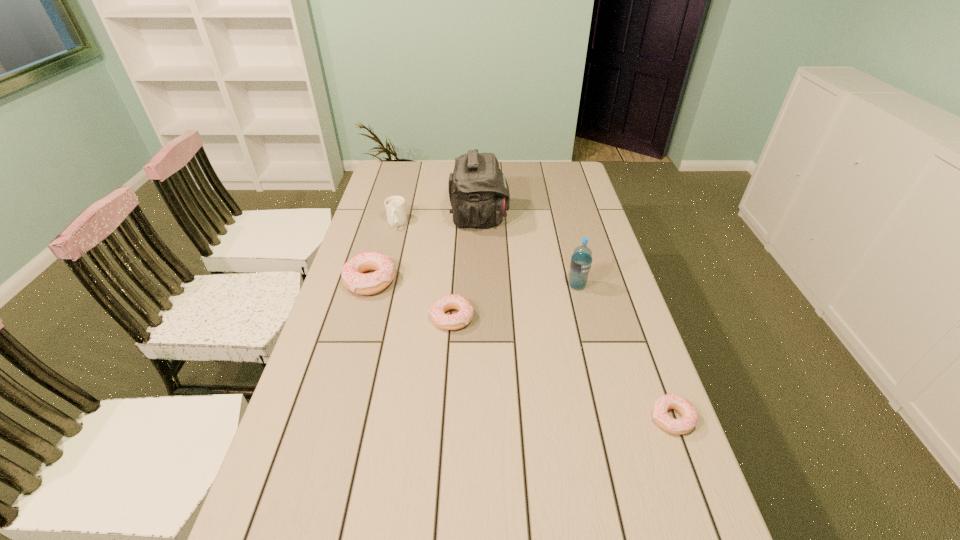
To achieve uniform spacing by inserting another doughnut among them, please point to a free space for this new doughnut. Please provide its 2D coordinates. Your answer should be formatted as a tuple, i.e. [(x, y)], where the tuple contains the x and y coordinates of a point satisfying the conditions above.

[(550, 362)]